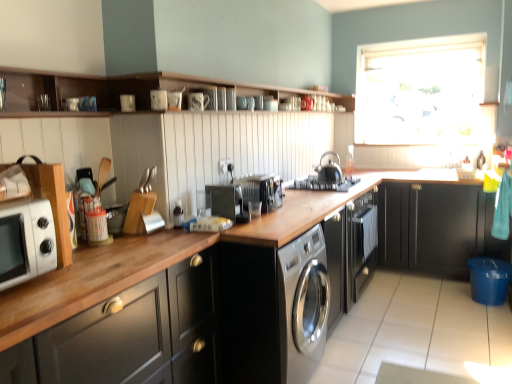
Find the location of `free spot to the right of white glossy microwave at left`. free spot to the right of white glossy microwave at left is located at coordinates (82, 279).